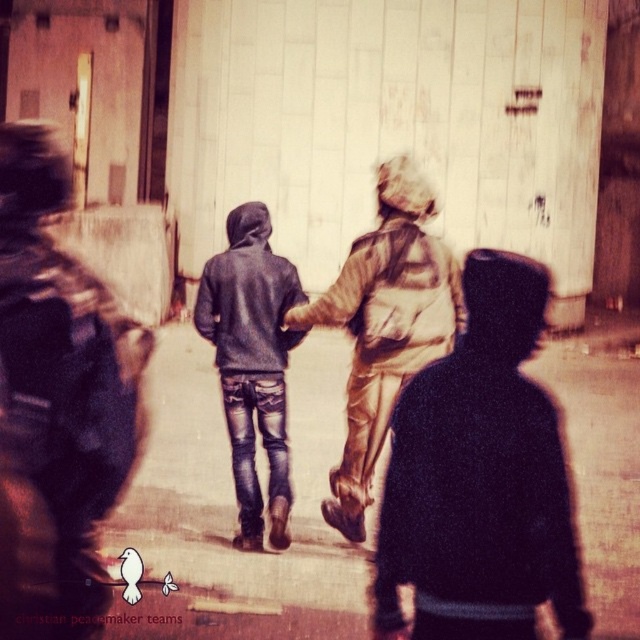
Question: Which point is closer to the camera?

Choices:
 (A) matte gray hoodie at center
 (B) black matte jacket at lower right
 (C) gold metallic jacket at center
 (D) dark gray hoodie at center

Answer: (D)

Question: In this image, where is black matte jacket at lower right located relative to matte gray hoodie at center?

Choices:
 (A) above
 (B) below

Answer: (B)

Question: Can you confirm if black matte jacket at lower right is positioned to the right of matte gray hoodie at center?

Choices:
 (A) no
 (B) yes

Answer: (B)

Question: Which object appears closest to the camera in this image?

Choices:
 (A) black matte jacket at lower right
 (B) dark gray hoodie at center

Answer: (B)

Question: Which point appears farthest from the camera in this image?

Choices:
 (A) (38, 157)
 (B) (273, 397)
 (C) (500, 289)

Answer: (B)

Question: Does dark gray hoodie at center have a smaller size compared to gold metallic jacket at center?

Choices:
 (A) yes
 (B) no

Answer: (A)